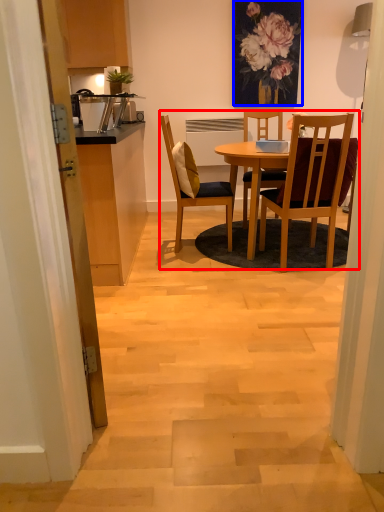
Question: Which object is further to the camera taking this photo, kitchen & dining room table (highlighted by a red box) or floral arrangement (highlighted by a blue box)?

Choices:
 (A) kitchen & dining room table
 (B) floral arrangement

Answer: (B)